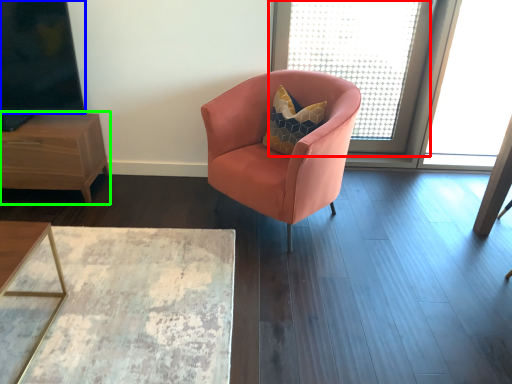
Question: Considering the real-world distances, which object is closest to window screen (highlighted by a red box)? window screen (highlighted by a blue box) or nightstand (highlighted by a green box).

Choices:
 (A) window screen
 (B) nightstand

Answer: (A)